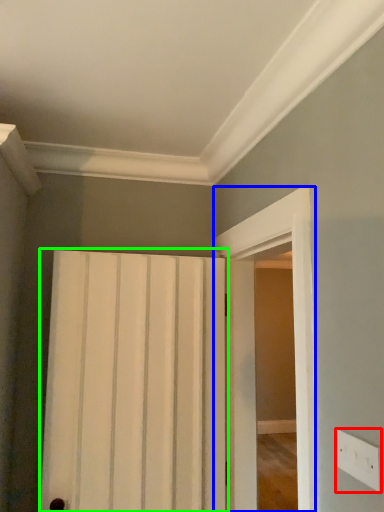
Question: Based on their relative distances, which object is nearer to electric outlet (highlighted by a red box)? Choose from screen door (highlighted by a blue box) and door (highlighted by a green box).

Choices:
 (A) screen door
 (B) door

Answer: (A)